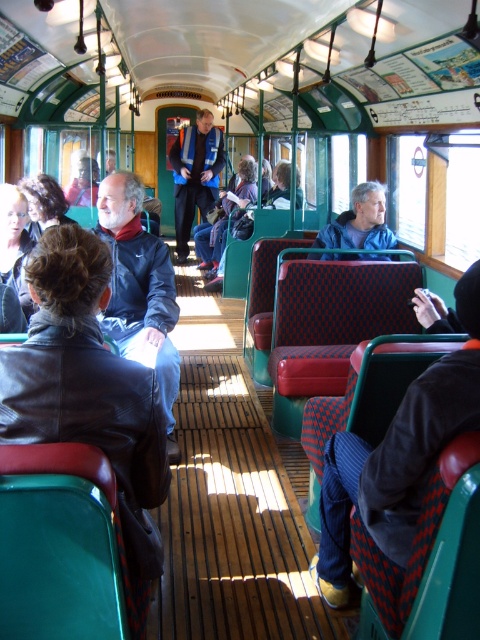
You are a photographer planning to take a photo of the dark blue corduroy pants at center and the matte black jacket at left in the train carriage. Which object should you focus on first if you want to ensure both are in sharp focus, considering their sizes?

The dark blue corduroy pants at center is thinner than the matte black jacket at left, so focusing on the larger matte black jacket at left first would ensure both are in sharp focus due to its size requiring more precise focus.

From the picture: You are a passenger in the vintage train carriage and want to reach the matte black jacket at left without stepping on the dark blue corduroy pants at center. Is this possible?

The dark blue corduroy pants at center are in front of the matte black jacket at left, so you would need to step around them to avoid the pants and reach the jacket.